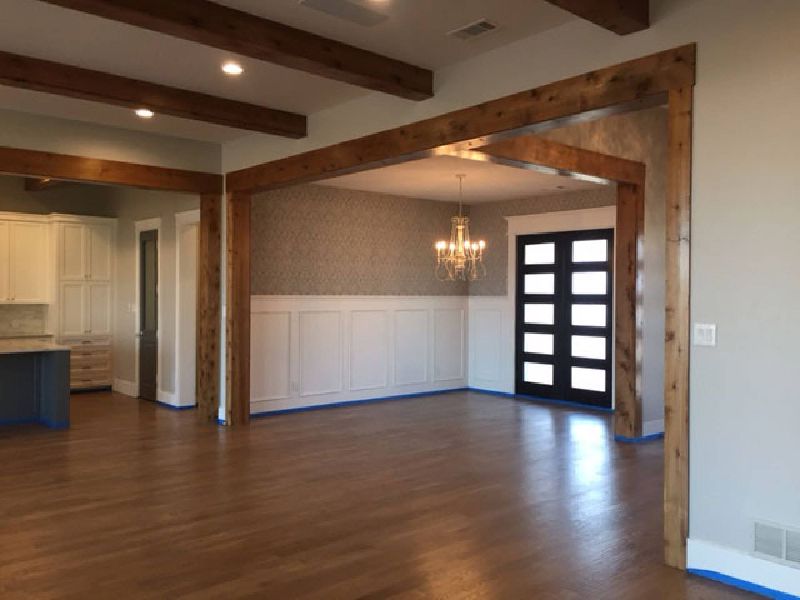
At what (x,y) coordinates should I click in order to perform the action: click on counter top. Please return your answer as a coordinate pair (x, y). This screenshot has width=800, height=600. Looking at the image, I should click on (33, 351).